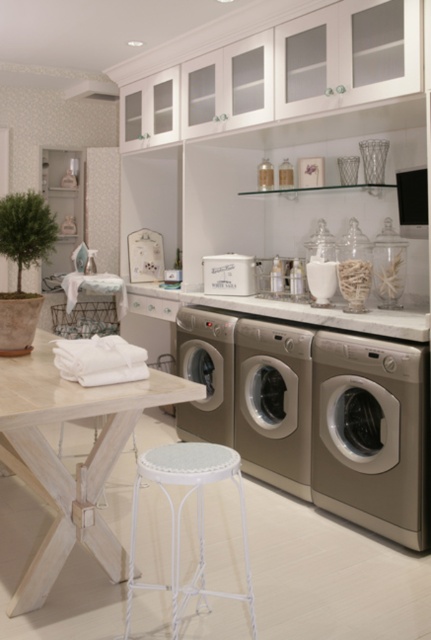
Is satin silver washing machine at center smaller than white matte container at center?

No.

Consider the image. Does satin silver washing machine at center have a lesser height compared to white matte container at center?

Incorrect, satin silver washing machine at center's height does not fall short of white matte container at center's.

Between point (243, 417) and point (244, 275), which one is positioned behind?

Positioned behind is point (244, 275).

This screenshot has height=640, width=431. Find the location of `satin silver washing machine at center`. satin silver washing machine at center is located at coordinates (274, 403).

Who is shorter, white wood table at center or satin silver washing machine at center?

Standing shorter between the two is satin silver washing machine at center.

Can you confirm if white wood table at center is positioned below satin silver washing machine at center?

Indeed, white wood table at center is positioned under satin silver washing machine at center.

At what (x,y) coordinates should I click in order to perform the action: click on white wood table at center. Please return your answer as a coordinate pair (x, y). This screenshot has height=640, width=431. Looking at the image, I should click on (62, 465).

Is white metal stool at lower center to the right of white soft towels at center from the viewer's perspective?

Yes, white metal stool at lower center is to the right of white soft towels at center.

Can you confirm if white metal stool at lower center is wider than white soft towels at center?

Indeed, white metal stool at lower center has a greater width compared to white soft towels at center.

Between point (171, 500) and point (119, 362), which one is positioned behind?

The point (119, 362) is more distant.

You are a GUI agent. You are given a task and a screenshot of the screen. Output one action in this format:
    pyautogui.click(x=<x>, y=<y>)
    Task: Click on the white metal stool at lower center
    This screenshot has height=640, width=431.
    Given the screenshot: What is the action you would take?
    pyautogui.click(x=180, y=518)